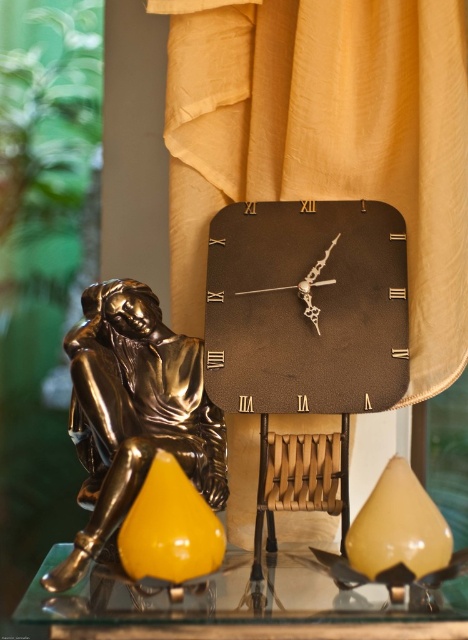
Who is more distant from viewer, [372,397] or [194,461]?

Positioned behind is point [372,397].

Is black leather clock at center to the right of shiny bronze statue at left from the viewer's perspective?

Correct, you'll find black leather clock at center to the right of shiny bronze statue at left.

At what (x,y) coordinates should I click in order to perform the action: click on black leather clock at center. Please return your answer as a coordinate pair (x, y). Looking at the image, I should click on (307, 307).

Between black leather clock at center and transparent glass table at center, which one has more height?

Standing taller between the two is black leather clock at center.

Is black leather clock at center smaller than transparent glass table at center?

Actually, black leather clock at center might be larger than transparent glass table at center.

Who is more distant from viewer, (x=307, y=397) or (x=245, y=573)?

The point (x=307, y=397) is more distant.

Find the location of a particular element. This screenshot has width=468, height=640. black leather clock at center is located at coordinates (307, 307).

Which is more to the left, shiny bronze statue at left or transparent glass table at center?

shiny bronze statue at left is more to the left.

Does point (82, 300) come closer to viewer compared to point (100, 625)?

No, it is behind (100, 625).

Where is `shiny bronze statue at left`? shiny bronze statue at left is located at coordinates (133, 412).